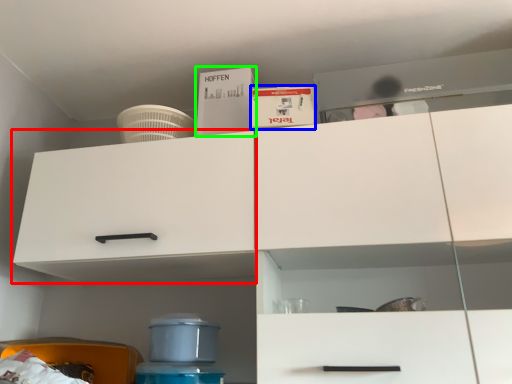
Question: Which is nearer to the cabinetry (highlighted by a red box)? box (highlighted by a blue box) or box (highlighted by a green box).

Choices:
 (A) box
 (B) box

Answer: (B)